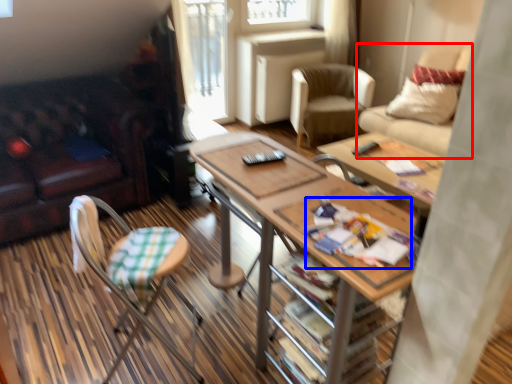
Question: Which object is closer to the camera taking this photo, chair (highlighted by a red box) or magazine (highlighted by a blue box)?

Choices:
 (A) chair
 (B) magazine

Answer: (B)